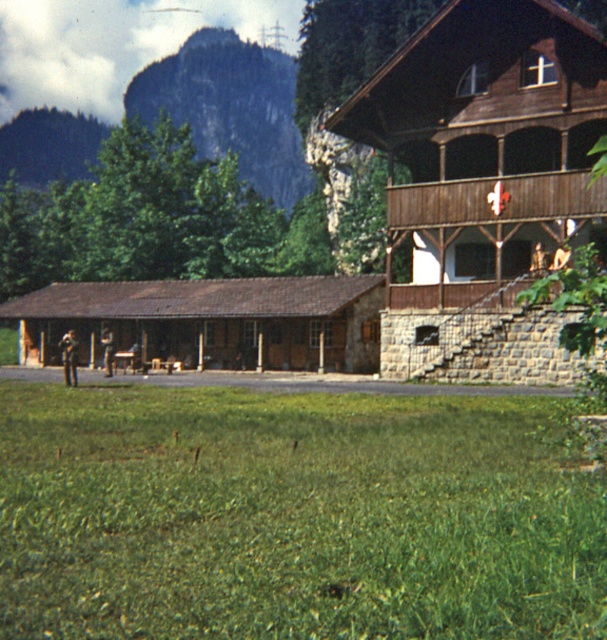
Question: Where is green grass at lower center located in relation to rugged stone mountain at upper left in the image?

Choices:
 (A) left
 (B) right

Answer: (B)

Question: Which point is farther to the camera?

Choices:
 (A) rugged stone mountain at upper left
 (B) green grass at lower center

Answer: (A)

Question: Among these points, which one is farthest from the camera?

Choices:
 (A) (565, 561)
 (B) (215, 52)

Answer: (B)

Question: In this image, where is green grass at lower center located relative to rugged stone mountain at upper left?

Choices:
 (A) left
 (B) right

Answer: (B)

Question: Which point appears farthest from the camera in this image?

Choices:
 (A) (205, 609)
 (B) (253, 157)

Answer: (B)

Question: Where is green grass at lower center located in relation to rugged stone mountain at upper left in the image?

Choices:
 (A) right
 (B) left

Answer: (A)